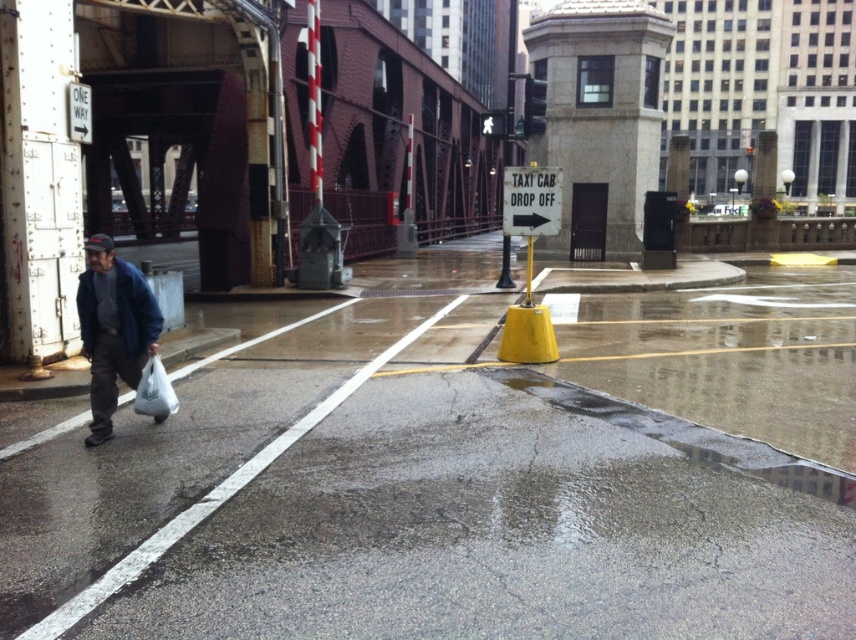
Question: Which point is closer to the camera taking this photo?

Choices:
 (A) (141, 387)
 (B) (12, 580)

Answer: (B)

Question: Among these points, which one is farthest from the camera?

Choices:
 (A) (107, 266)
 (B) (149, 394)
 (C) (489, 584)

Answer: (B)

Question: Is blue denim jacket at left wider than white plastic bag at lower left?

Choices:
 (A) yes
 (B) no

Answer: (A)

Question: Is concrete wet pavement at lower left in front of white plastic bag at lower left?

Choices:
 (A) yes
 (B) no

Answer: (A)

Question: Can you confirm if concrete wet pavement at lower left is wider than white plastic bag at lower left?

Choices:
 (A) no
 (B) yes

Answer: (B)

Question: Which of the following is the farthest from the observer?

Choices:
 (A) blue denim jacket at left
 (B) concrete wet pavement at lower left

Answer: (A)